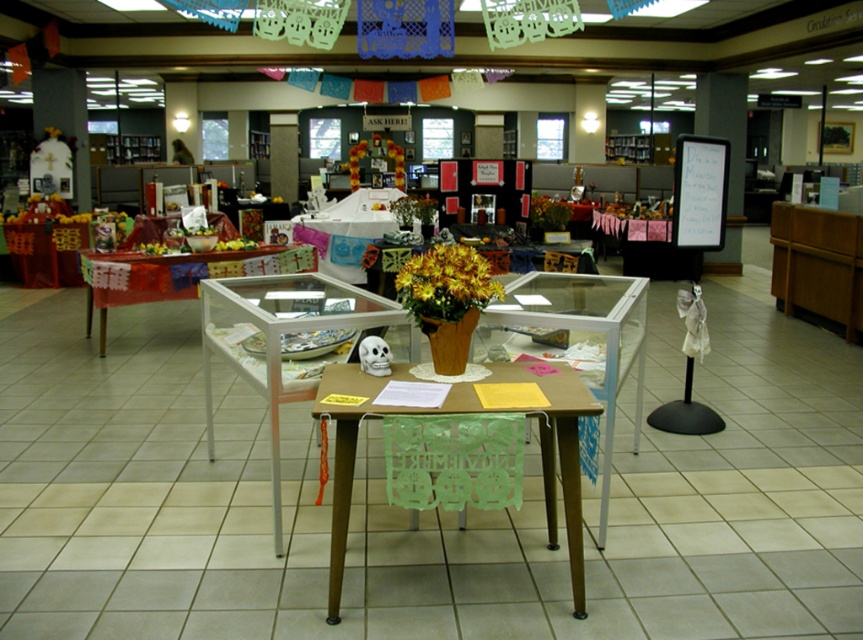
You are standing in the library and want to place a 3.5 meter long banner on the clear glass table at center. Can you reach the table from your current position?

The clear glass table at center is 2.67 meters away from viewer, so yes, you can reach the table from your current position since the distance is less than the banner length.

You are standing in the library and want to place a new decoration on the translucent glass table at center. According to the image, where exactly should you place it?

The translucent glass table at center should be placed at the 2D coordinate point of (177, 275).